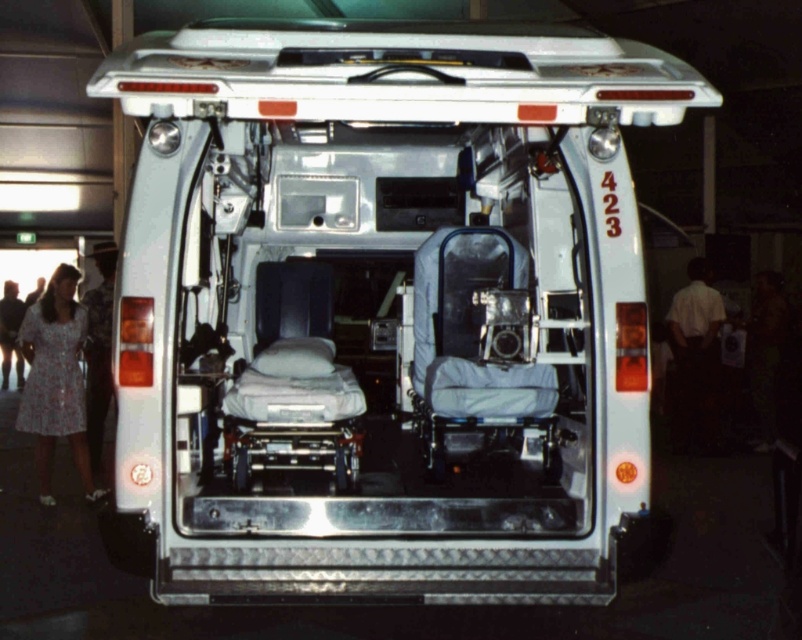
You are a paramedic who needs to move a medical kit from the matte gray ambulance at center to the white shirt at right. Given that the medical kit weighs 4.5 kg and you can carry it comfortably for up to 3 meters, will you need assistance to carry it the entire distance?

The distance between the matte gray ambulance at center and the white shirt at right is 5.14 meters. Since the paramedic can carry the 4.5 kg medical kit comfortably for up to 3 meters, they will need assistance for the remaining distance beyond 3 meters.

You are a paramedic standing outside the ambulance and need to quickly access the light blue dress at lower left. Is the matte gray ambulance at center blocking your direct path to the dress?

The matte gray ambulance at center is closer to the viewer than the light blue dress at lower left, so the ambulance is blocking the direct path to the dress.

You are a paramedic who needs to load a light blue dress at lower left into the matte gray ambulance at center. Can you fit the dress vertically inside the ambulance without folding it?

The matte gray ambulance at center is much taller than the light blue dress at lower left, so yes, the dress can be placed vertically inside the ambulance without folding.